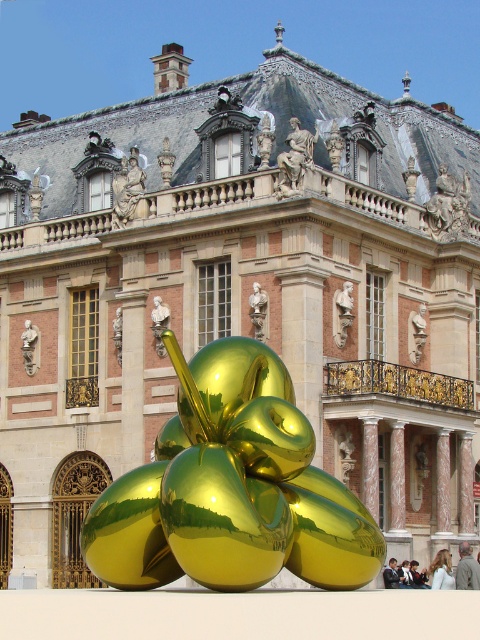
Is point (409, 348) closer to camera compared to point (158, 342)?

No, (409, 348) is behind (158, 342).

Can you confirm if matte white bust at center is positioned to the right of gold reflective statue at center?

Correct, you'll find matte white bust at center to the right of gold reflective statue at center.

Between point (420, 355) and point (166, 324), which one is positioned behind?

Positioned behind is point (420, 355).

Find the location of a particular element. Image resolution: width=480 pixels, height=640 pixels. matte white bust at center is located at coordinates (417, 332).

From the picture: Is polished stone statue at upper center smaller than light brown leather jacket at lower center?

Yes.

Which is above, polished stone statue at upper center or light brown leather jacket at lower center?

polished stone statue at upper center

This screenshot has height=640, width=480. I want to click on polished stone statue at upper center, so click(x=410, y=177).

I want to click on polished stone statue at upper center, so click(410, 177).

Between point (430, 205) and point (156, 332), which one is positioned behind?

Positioned behind is point (430, 205).

How much distance is there between polished bronze statue at upper right and gold reflective statue at center?

polished bronze statue at upper right and gold reflective statue at center are 15.62 meters apart.

Where is `polished bronze statue at upper right`? polished bronze statue at upper right is located at coordinates coord(448,205).